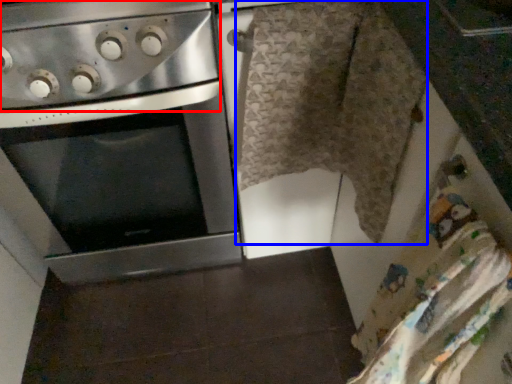
Question: Which point is closer to the camera, gas stove (highlighted by a red box) or blanket (highlighted by a blue box)?

Choices:
 (A) gas stove
 (B) blanket

Answer: (A)